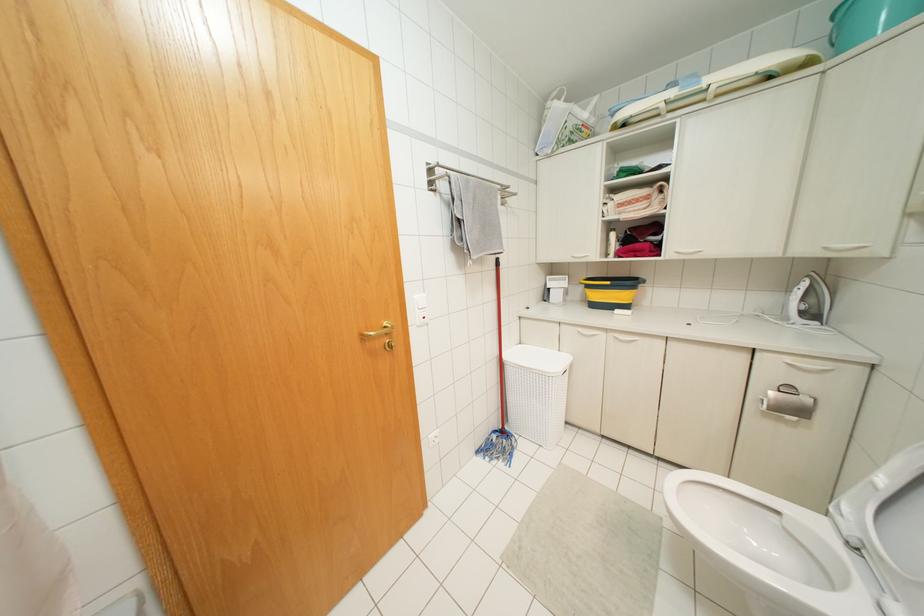
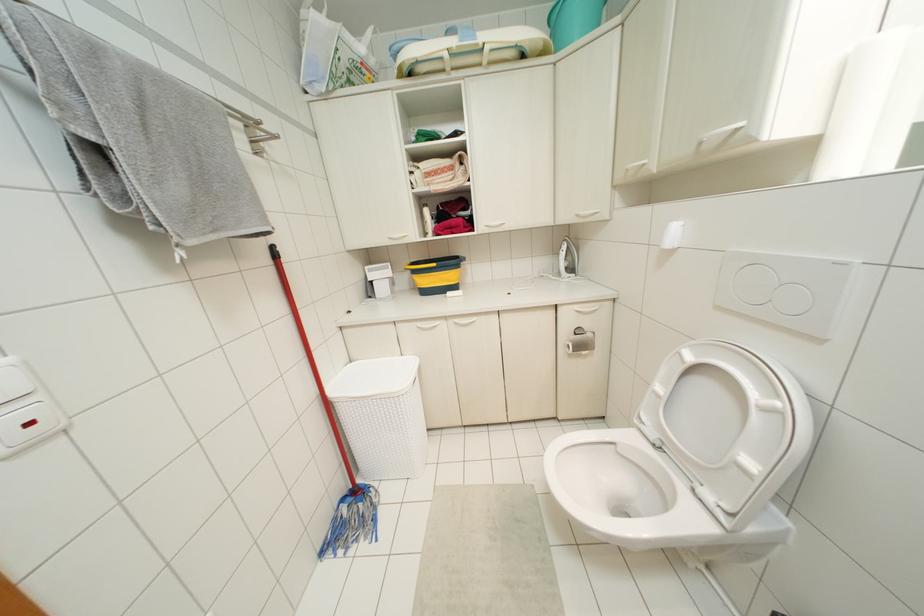
Find the pixel in the second image that matches pixel 615 334 in the first image.

(456, 320)